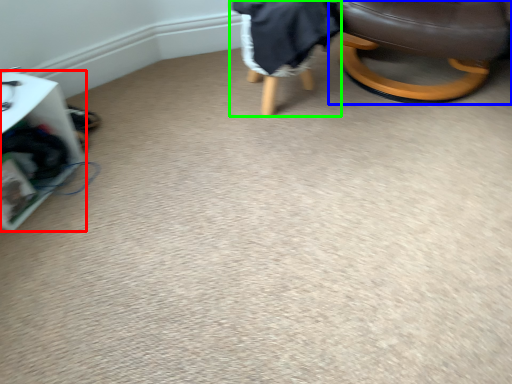
Question: Considering the real-world distances, which object is closest to furniture (highlighted by a red box)? chair (highlighted by a blue box) or bean bag chair (highlighted by a green box).

Choices:
 (A) chair
 (B) bean bag chair

Answer: (B)